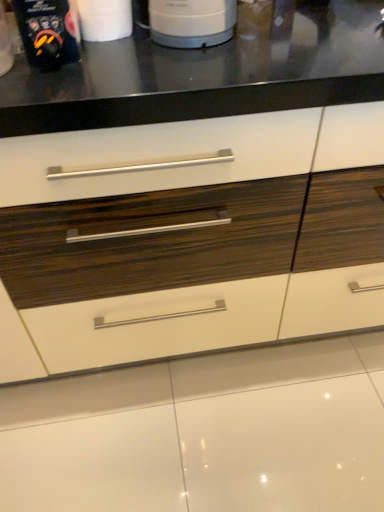
Locate an element on the screen. vacant space in front of white matte paper towel at upper left is located at coordinates (124, 71).